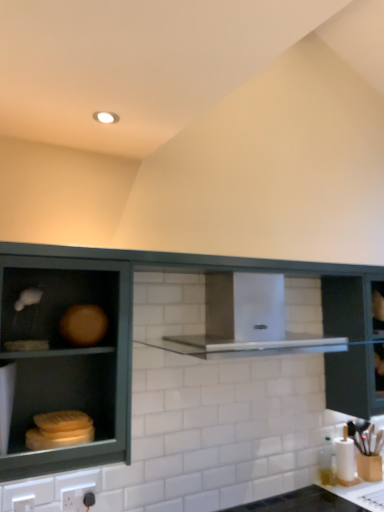
How much space does green matte cabinet at left, which ranks as the 1th cabinetry in back-to-front order, occupy horizontally?

The width of green matte cabinet at left, which ranks as the 1th cabinetry in back-to-front order, is 2.66 inches.

Find the location of `white plastic electric outlet at lower left, which is counted as the second electric outlet, starting from the right`. white plastic electric outlet at lower left, which is counted as the second electric outlet, starting from the right is located at coordinates (23, 503).

The image size is (384, 512). What are the coordinates of `black plastic electric outlet at lower center, arranged as the 2th electric outlet when viewed from the left` in the screenshot? It's located at (78, 497).

What do you see at coordinates (350, 346) in the screenshot? The image size is (384, 512). I see `transparent glass cabinet at right` at bounding box center [350, 346].

Measure the distance between transparent glass cabinet at right and camera.

transparent glass cabinet at right is 7.65 feet away from camera.

The image size is (384, 512). Describe the element at coordinates (247, 318) in the screenshot. I see `stainless steel vent at center` at that location.

Where is `green matte cabinet at left, which ranks as the 1th cabinetry in back-to-front order`? This screenshot has width=384, height=512. green matte cabinet at left, which ranks as the 1th cabinetry in back-to-front order is located at coordinates (161, 342).

Considering the relative positions of matte wood cabinet at left, which is the second cabinetry from back to front, and black plastic electric outlet at lower center, placed as the 1th electric outlet when sorted from back to front, in the image provided, is matte wood cabinet at left, which is the second cabinetry from back to front, to the left or to the right of black plastic electric outlet at lower center, placed as the 1th electric outlet when sorted from back to front,?

Clearly, matte wood cabinet at left, which is the second cabinetry from back to front, is on the left of black plastic electric outlet at lower center, placed as the 1th electric outlet when sorted from back to front, in the image.

From the image's perspective, which is below, matte wood cabinet at left, which is the second cabinetry from back to front, or black plastic electric outlet at lower center, placed as the 1th electric outlet when sorted from back to front?

black plastic electric outlet at lower center, placed as the 1th electric outlet when sorted from back to front, is shown below in the image.

Is point (99, 419) closer or farther from the camera than point (68, 499)?

Point (99, 419) is positioned farther from the camera compared to point (68, 499).

Is transparent glass cabinet at right next to matte wood cabinet at left, which is the second cabinetry from back to front?

No, transparent glass cabinet at right is not making contact with matte wood cabinet at left, which is the second cabinetry from back to front.

Would you say transparent glass cabinet at right is outside matte wood cabinet at left, which is the second cabinetry from back to front?

Indeed, transparent glass cabinet at right is completely outside matte wood cabinet at left, which is the second cabinetry from back to front.

Is transparent glass cabinet at right wider or thinner than matte wood cabinet at left, which is the second cabinetry from back to front?

transparent glass cabinet at right is wider than matte wood cabinet at left, which is the second cabinetry from back to front.

Which is in front, transparent glass cabinet at right or matte wood cabinet at left, marked as the 1th cabinetry in a front-to-back arrangement?

matte wood cabinet at left, marked as the 1th cabinetry in a front-to-back arrangement, is more forward.

Can we say black plastic electric outlet at lower center, placed as the 1th electric outlet when sorted from back to front, lies outside transparent glass cabinet at right?

black plastic electric outlet at lower center, placed as the 1th electric outlet when sorted from back to front, lies outside transparent glass cabinet at right's area.

At what (x,y) coordinates should I click in order to perform the action: click on the 1st electric outlet below the transparent glass cabinet at right (from a real-world perspective). Please return your answer as a coordinate pair (x, y). This screenshot has width=384, height=512. Looking at the image, I should click on (78, 497).

Does black plastic electric outlet at lower center, placed as the 1th electric outlet when sorted from back to front, have a lesser height compared to transparent glass cabinet at right?

Yes.

Considering the sizes of objects black plastic electric outlet at lower center, positioned as the 1th electric outlet in right-to-left order, and green matte cabinet at left, positioned as the second cabinetry in front-to-back order, in the image provided, who is wider, black plastic electric outlet at lower center, positioned as the 1th electric outlet in right-to-left order, or green matte cabinet at left, positioned as the second cabinetry in front-to-back order,?

Wider between the two is green matte cabinet at left, positioned as the second cabinetry in front-to-back order.

Considering the sizes of objects black plastic electric outlet at lower center, arranged as the 2th electric outlet when viewed from the left, and green matte cabinet at left, which ranks as the 1th cabinetry in back-to-front order, in the image provided, who is taller, black plastic electric outlet at lower center, arranged as the 2th electric outlet when viewed from the left, or green matte cabinet at left, which ranks as the 1th cabinetry in back-to-front order,?

green matte cabinet at left, which ranks as the 1th cabinetry in back-to-front order, is taller.

Is black plastic electric outlet at lower center, placed as the 1th electric outlet when sorted from back to front, next to green matte cabinet at left, positioned as the second cabinetry in front-to-back order?

black plastic electric outlet at lower center, placed as the 1th electric outlet when sorted from back to front, and green matte cabinet at left, positioned as the second cabinetry in front-to-back order, are not in contact.

Locate an element on the screen. the 1st cabinetry above when counting from the black plastic electric outlet at lower center, arranged as the 2th electric outlet when viewed from the left (from the image's perspective) is located at coordinates (161, 342).

How many degrees apart are the facing directions of white plastic electric outlet at lower left, which is counted as the second electric outlet, starting from the right, and green matte cabinet at left, positioned as the second cabinetry in front-to-back order?

1.22 degrees.

Does white plastic electric outlet at lower left, the 1th electric outlet positioned from the front, have a lesser height compared to green matte cabinet at left, positioned as the second cabinetry in front-to-back order?

Yes.

Considering the sizes of objects white plastic electric outlet at lower left, the 1th electric outlet positioned from the front, and green matte cabinet at left, positioned as the second cabinetry in front-to-back order, in the image provided, who is bigger, white plastic electric outlet at lower left, the 1th electric outlet positioned from the front, or green matte cabinet at left, positioned as the second cabinetry in front-to-back order,?

With larger size is green matte cabinet at left, positioned as the second cabinetry in front-to-back order.

Is white plastic electric outlet at lower left, the 1th electric outlet positioned from the front, situated inside green matte cabinet at left, which ranks as the 1th cabinetry in back-to-front order, or outside?

white plastic electric outlet at lower left, the 1th electric outlet positioned from the front, lies within the bounds of green matte cabinet at left, which ranks as the 1th cabinetry in back-to-front order.

How different are the orientations of black plastic electric outlet at lower center, arranged as the 2th electric outlet when viewed from the left, and stainless steel vent at center in degrees?

1.37 degrees separate the facing orientations of black plastic electric outlet at lower center, arranged as the 2th electric outlet when viewed from the left, and stainless steel vent at center.

Considering the positions of objects black plastic electric outlet at lower center, arranged as the 2th electric outlet when viewed from the left, and stainless steel vent at center in the image provided, who is in front, black plastic electric outlet at lower center, arranged as the 2th electric outlet when viewed from the left, or stainless steel vent at center?

stainless steel vent at center is closer to the camera.

Is black plastic electric outlet at lower center, arranged as the 2th electric outlet when viewed from the left, aimed at stainless steel vent at center?

No, black plastic electric outlet at lower center, arranged as the 2th electric outlet when viewed from the left, is not oriented towards stainless steel vent at center.

Is point (61, 504) positioned behind point (239, 293)?

No, (61, 504) is in front of (239, 293).

Can you confirm if black glossy countertop at lower right is taller than black plastic electric outlet at lower center, positioned as the 1th electric outlet in right-to-left order?

Correct, black glossy countertop at lower right is much taller as black plastic electric outlet at lower center, positioned as the 1th electric outlet in right-to-left order.

At what (x,y) coordinates should I click in order to perform the action: click on counter top located below the black plastic electric outlet at lower center, arranged as the 2th electric outlet when viewed from the left (from the image's perspective). Please return your answer as a coordinate pair (x, y). This screenshot has height=512, width=384. Looking at the image, I should click on (301, 502).

Does black glossy countertop at lower right contain black plastic electric outlet at lower center, arranged as the 2th electric outlet when viewed from the left?

No.

From the image's perspective, starting from the matte wood cabinet at left, which is the second cabinetry from back to front, which electric outlet is the 2nd one below? Please provide its 2D coordinates.

[(78, 497)]

Which cabinetry is the 2nd one when counting from the left side of the transparent glass cabinet at right? Please provide its 2D coordinates.

[(67, 359)]

When comparing their distances from transparent glass cabinet at right, does matte wood cabinet at left, which is the second cabinetry from back to front, or black plastic electric outlet at lower center, positioned as the 1th electric outlet in right-to-left order, seem closer?

Among the two, matte wood cabinet at left, which is the second cabinetry from back to front, is located nearer to transparent glass cabinet at right.

Looking at the image, which one is located closer to black plastic electric outlet at lower center, positioned as the 1th electric outlet in right-to-left order, matte wood cabinet at left, which is the second cabinetry from back to front, or black glossy countertop at lower right?

The object closer to black plastic electric outlet at lower center, positioned as the 1th electric outlet in right-to-left order, is matte wood cabinet at left, which is the second cabinetry from back to front.

Estimate the real-world distances between objects in this image. Which object is closer to stainless steel vent at center, black plastic electric outlet at lower center, arranged as the 2th electric outlet when viewed from the left, or transparent glass cabinet at right?

Based on the image, transparent glass cabinet at right appears to be nearer to stainless steel vent at center.

Which object lies further to the anchor point white plastic electric outlet at lower left, which is counted as the second electric outlet, starting from the right, transparent glass cabinet at right or green matte cabinet at left, positioned as the second cabinetry in front-to-back order?

The object further to white plastic electric outlet at lower left, which is counted as the second electric outlet, starting from the right, is transparent glass cabinet at right.

Looking at the image, which one is located closer to green matte cabinet at left, which ranks as the 1th cabinetry in back-to-front order, matte wood cabinet at left, marked as the 1th cabinetry in a front-to-back arrangement, or black glossy countertop at lower right?

matte wood cabinet at left, marked as the 1th cabinetry in a front-to-back arrangement.

Based on the photo, when comparing their distances from white plastic electric outlet at lower left, the 1th electric outlet positioned from the front, does transparent glass cabinet at right or matte wood cabinet at left, marked as the 1th cabinetry in a front-to-back arrangement, seem further?

transparent glass cabinet at right lies further to white plastic electric outlet at lower left, the 1th electric outlet positioned from the front, than the other object.

Estimate the real-world distances between objects in this image. Which object is further from black plastic electric outlet at lower center, which appears as the second electric outlet when viewed from the front, white plastic electric outlet at lower left, which is counted as the second electric outlet, starting from the right, or green matte cabinet at left, positioned as the second cabinetry in front-to-back order?

green matte cabinet at left, positioned as the second cabinetry in front-to-back order, is further to black plastic electric outlet at lower center, which appears as the second electric outlet when viewed from the front.

From the image, which object appears to be farther from stainless steel vent at center, green matte cabinet at left, positioned as the second cabinetry in front-to-back order, or matte wood cabinet at left, which is the second cabinetry from back to front?

matte wood cabinet at left, which is the second cabinetry from back to front, is positioned further to the anchor stainless steel vent at center.

The width and height of the screenshot is (384, 512). Identify the location of electric outlet situated between matte wood cabinet at left, which is the second cabinetry from back to front, and black glossy countertop at lower right from left to right. (x=78, y=497).

In order to click on glass door between stainless steel vent at center and black glossy countertop at lower right vertically in this screenshot , I will do `click(350, 346)`.

Where is `electric outlet that lies between matte wood cabinet at left, which is the second cabinetry from back to front, and black plastic electric outlet at lower center, positioned as the 1th electric outlet in right-to-left order, from top to bottom`? The width and height of the screenshot is (384, 512). electric outlet that lies between matte wood cabinet at left, which is the second cabinetry from back to front, and black plastic electric outlet at lower center, positioned as the 1th electric outlet in right-to-left order, from top to bottom is located at coordinates (23, 503).

Where is `electric outlet located between white plastic electric outlet at lower left, which is counted as the second electric outlet, starting from the right, and stainless steel vent at center in the left-right direction`? Image resolution: width=384 pixels, height=512 pixels. electric outlet located between white plastic electric outlet at lower left, which is counted as the second electric outlet, starting from the right, and stainless steel vent at center in the left-right direction is located at coordinates (78, 497).